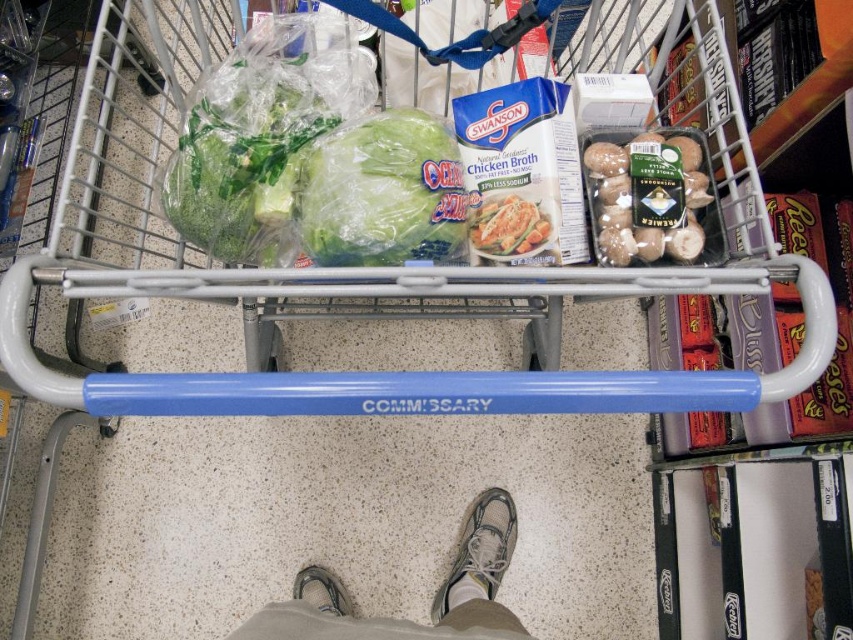
Can you confirm if gray mesh shoe at lower center is thinner than gray fabric shoe at lower center?

In fact, gray mesh shoe at lower center might be wider than gray fabric shoe at lower center.

Does gray mesh shoe at lower center appear under gray fabric shoe at lower center?

No.

Is point (445, 605) positioned before point (305, 573)?

Yes, it is.

At what (x,y) coordinates should I click in order to perform the action: click on gray mesh shoe at lower center. Please return your answer as a coordinate pair (x, y). The image size is (853, 640). Looking at the image, I should click on (479, 552).

Who is more forward, (701, 168) or (492, 592)?

Point (701, 168)

Between point (610, 166) and point (465, 564), which one is positioned in front?

Positioned in front is point (610, 166).

I want to click on smooth brown mushrooms at center, so click(650, 198).

Can you confirm if gray fabric pants at lower center is positioned below matte plastic chicken at center?

Yes.

Looking at this image, can you confirm if gray fabric pants at lower center is taller than matte plastic chicken at center?

Correct, gray fabric pants at lower center is much taller as matte plastic chicken at center.

The width and height of the screenshot is (853, 640). What do you see at coordinates (433, 598) in the screenshot? I see `gray fabric pants at lower center` at bounding box center [433, 598].

The width and height of the screenshot is (853, 640). In order to click on gray fabric pants at lower center in this screenshot , I will do `click(433, 598)`.